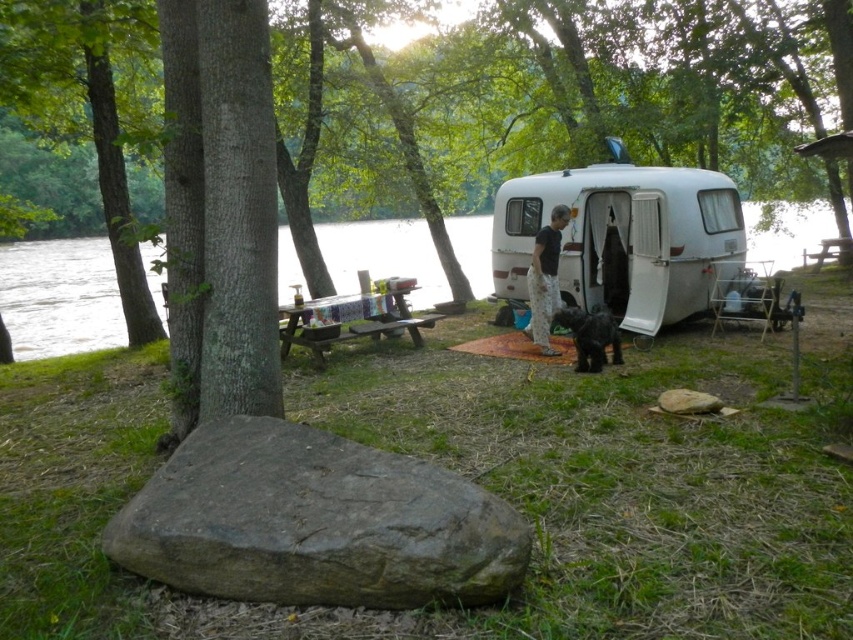
Question: Estimate the real-world distances between objects in this image. Which object is closer to the gray rock at lower left?

Choices:
 (A) clear water at center
 (B) brown textured tree trunk at center
 (C) wooden picnic table at center

Answer: (C)

Question: Which of the following is the farthest from the observer?

Choices:
 (A) black fuzzy dog at center
 (B) white matte trailer at center

Answer: (B)

Question: Which object is farther from the camera taking this photo?

Choices:
 (A) wooden picnic table at center
 (B) white matte trailer at center
 (C) clear water at center
 (D) black fuzzy dog at center

Answer: (B)

Question: Does gray rock at lower left appear under wooden picnic table at center?

Choices:
 (A) no
 (B) yes

Answer: (B)

Question: Is brown textured tree trunk at center below clear water at center?

Choices:
 (A) no
 (B) yes

Answer: (A)

Question: Does gray rock at lower left have a greater width compared to black fuzzy dog at center?

Choices:
 (A) yes
 (B) no

Answer: (A)